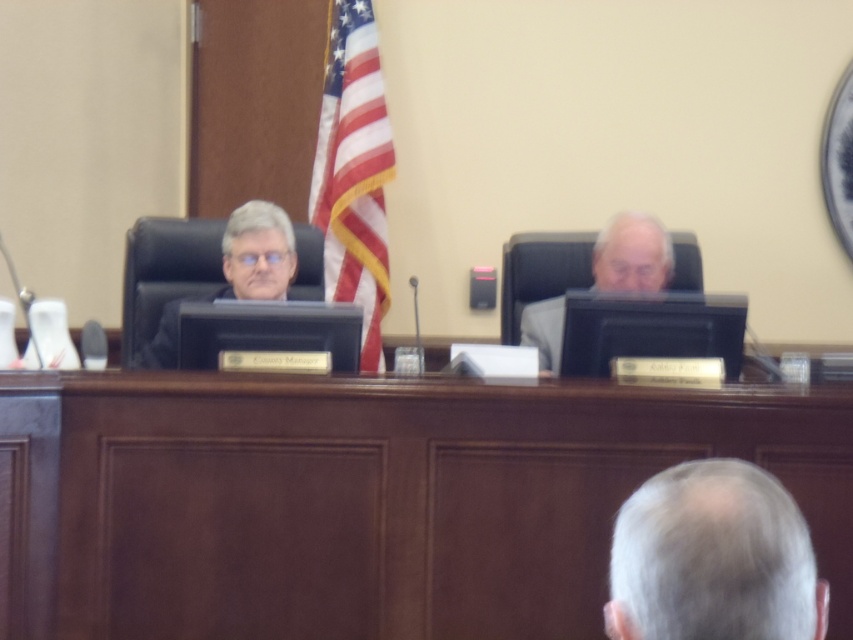
Can you confirm if brown wood table at center is thinner than gray fabric chair at center?

Incorrect, brown wood table at center's width is not less than gray fabric chair at center's.

The width and height of the screenshot is (853, 640). What are the coordinates of `brown wood table at center` in the screenshot? It's located at (366, 499).

Where is `brown wood table at center`? The height and width of the screenshot is (640, 853). brown wood table at center is located at coordinates (366, 499).

Which of these two, gray hair at lower right or american flag at center, stands taller?

Standing taller between the two is american flag at center.

In the scene shown: Does gray hair at lower right have a lesser height compared to american flag at center?

Yes, gray hair at lower right is shorter than american flag at center.

At what (x,y) coordinates should I click in order to perform the action: click on gray hair at lower right. Please return your answer as a coordinate pair (x, y). Looking at the image, I should click on tap(712, 557).

Which of these two, brown wood table at center or gray hair at lower right, stands shorter?

Standing shorter between the two is gray hair at lower right.

Between brown wood table at center and gray hair at lower right, which one is positioned lower?

Positioned lower is brown wood table at center.

Describe the element at coordinates (366, 499) in the screenshot. I see `brown wood table at center` at that location.

The image size is (853, 640). What are the coordinates of `brown wood table at center` in the screenshot? It's located at (366, 499).